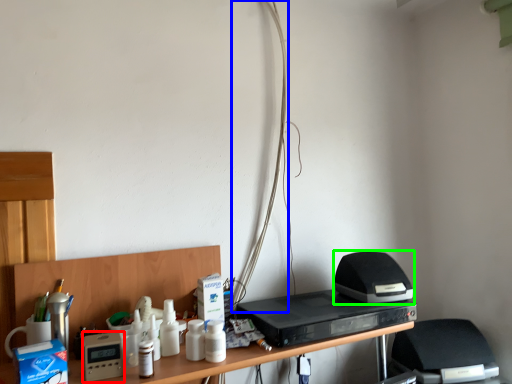
Question: Estimate the real-world distances between objects in this image. Which object is farther from appliance (highlighted by a red box), wire (highlighted by a blue box) or appliance (highlighted by a green box)?

Choices:
 (A) wire
 (B) appliance

Answer: (B)